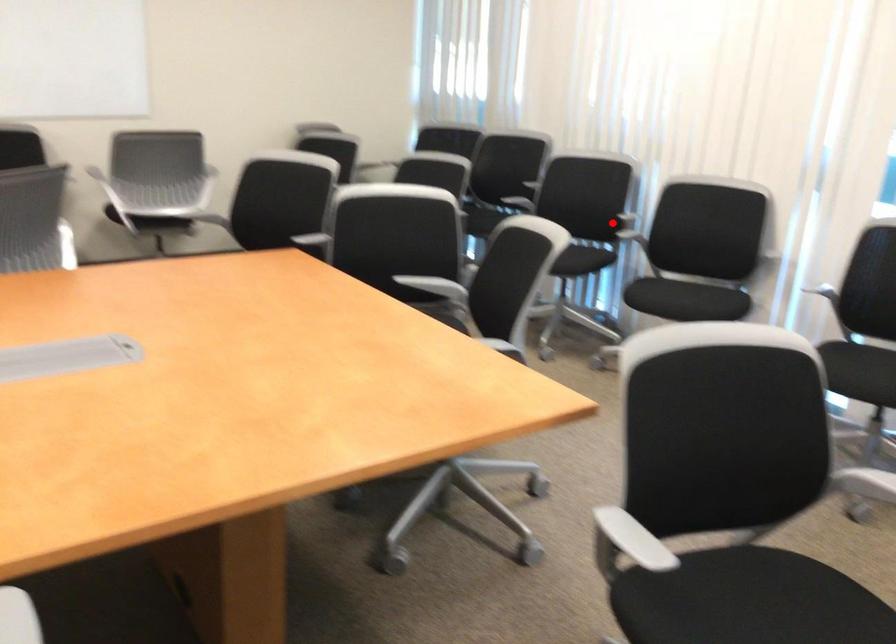
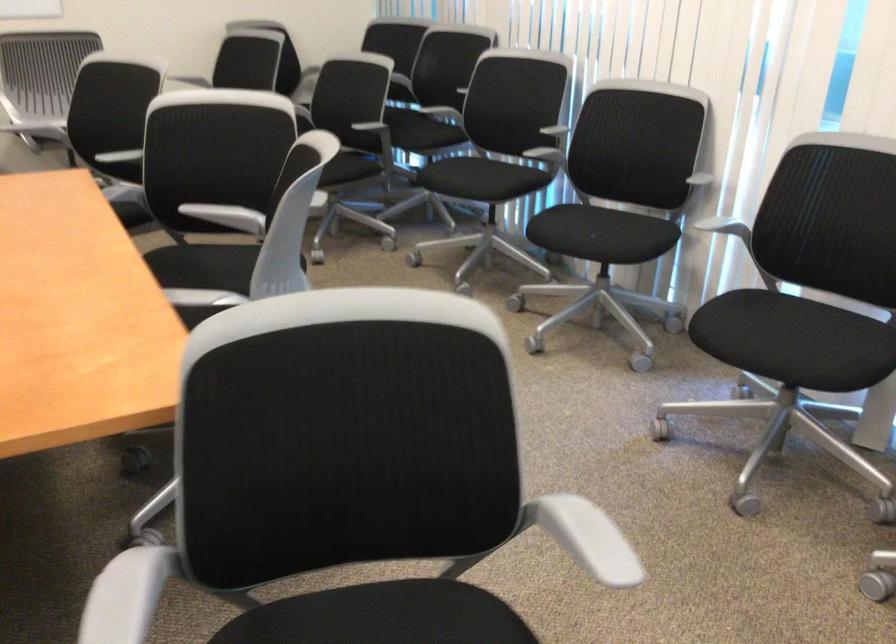
The point at the highlighted location is marked in the first image. Where is the corresponding point in the second image?

(543, 146)